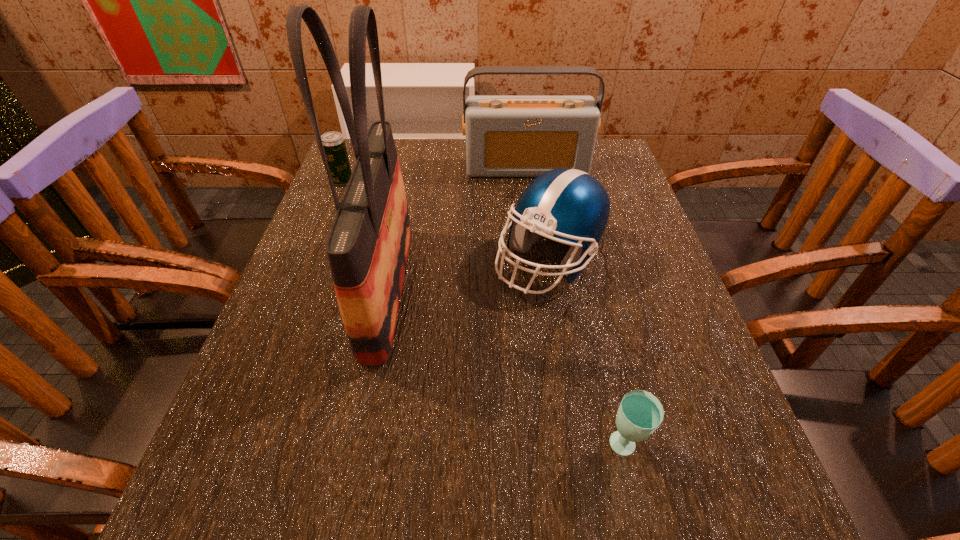
Where is `vacant point located on the back of the nearest object`? vacant point located on the back of the nearest object is located at coordinates (584, 281).

In order to click on radio receiver present at the far edge in this screenshot , I will do `click(506, 136)`.

Locate an element on the screen. beer can that is positioned at the far edge is located at coordinates (334, 145).

Identify the location of shopping bag situated at the left edge. (368, 244).

This screenshot has width=960, height=540. What are the coordinates of `beer can that is at the left edge` in the screenshot? It's located at (334, 145).

Locate an element on the screen. radio receiver situated at the right edge is located at coordinates (506, 136).

Where is `football helmet that is positioned at the right edge`? Image resolution: width=960 pixels, height=540 pixels. football helmet that is positioned at the right edge is located at coordinates (569, 204).

Identify the location of glass that is at the right edge. Image resolution: width=960 pixels, height=540 pixels. (640, 412).

This screenshot has height=540, width=960. Find the location of `object located at the far left corner`. object located at the far left corner is located at coordinates (334, 145).

Find the location of `object that is at the far right corner`. object that is at the far right corner is located at coordinates (506, 136).